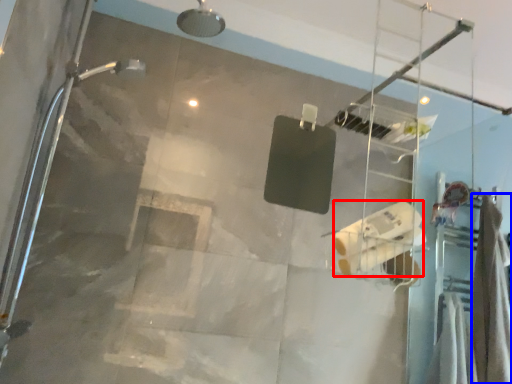
Question: Which of the following is the closest to the observer, toilet paper (highlighted by a red box) or shower curtain (highlighted by a blue box)?

Choices:
 (A) toilet paper
 (B) shower curtain

Answer: (A)